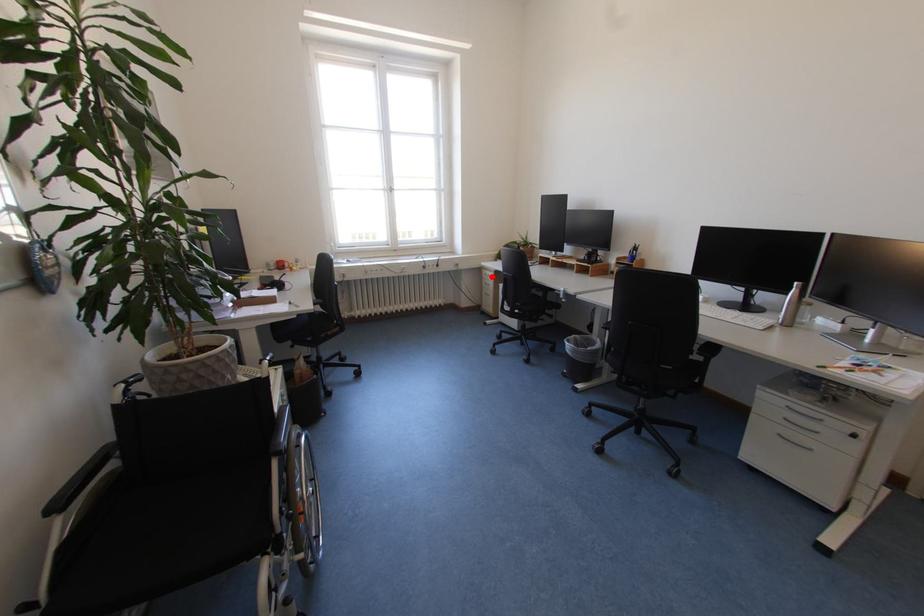
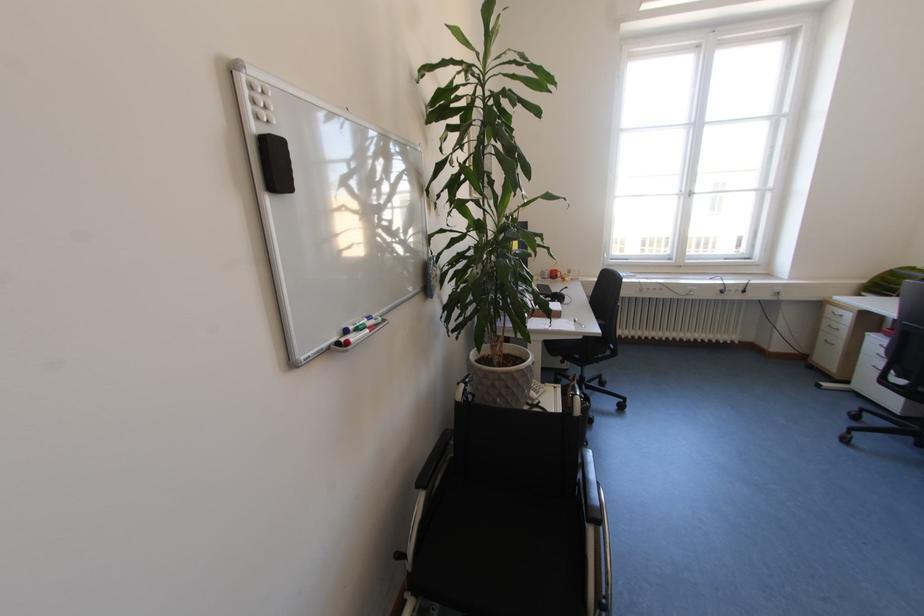
The point at the highlighted location is marked in the first image. Where is the corresponding point in the second image?

(835, 315)